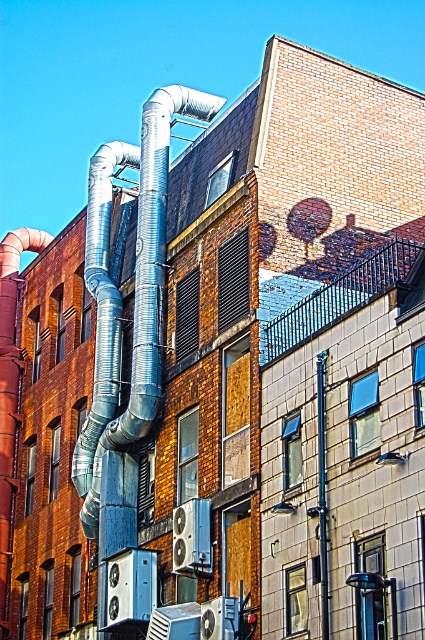
You are a maintenance worker inspecting the building. You notice the silver metallic pipes at left and the brushed metal pole at center. Which object is positioned higher relative to the other?

The silver metallic pipes at left are positioned higher than the brushed metal pole at center.

You are an engineer inspecting the building and need to determine if the silver metallic pipes at left can be replaced with the same material as the brushed metal pole at center. Based on their widths, would this be feasible?

The silver metallic pipes at left are wider than the brushed metal pole at center, so replacing them with the same material would require adjusting the width to match the pole.

You are standing in front of the building and notice two points marked on the ducts. The first point is at coordinate point (102, 301) and the second is at point (325, 596). Which point is closer to you?

Point (102, 301) is further to the camera than point (325, 596), so the point closer to you is point (325, 596).